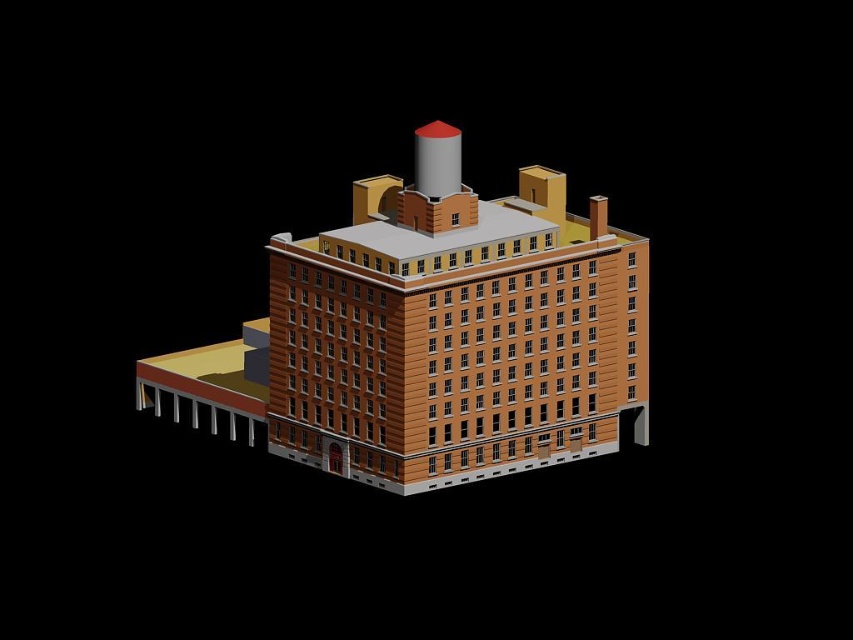
You are standing at the base of the building and want to take a photo of the point labeled as point [643,438] on the roof. The camera you are using has a maximum zoom range of 1000 feet. Will you be able to clearly capture the point in your photo?

The point [643,438] is 1189.85 feet away from the camera, which exceeds the maximum zoom range of 1000 feet. Therefore, the camera will not be able to clearly capture the point in the photo.

Based on the scene description, what is located at the coordinates point (434, 339)?

The brown brick building at center is located at point (434, 339).

You are standing at the origin point of a coordinate system placed at the bottom left corner of the image. The brown brick building at center is located at coordinates approximately where?

The brown brick building at center is located at coordinates approximately at point [434,339].